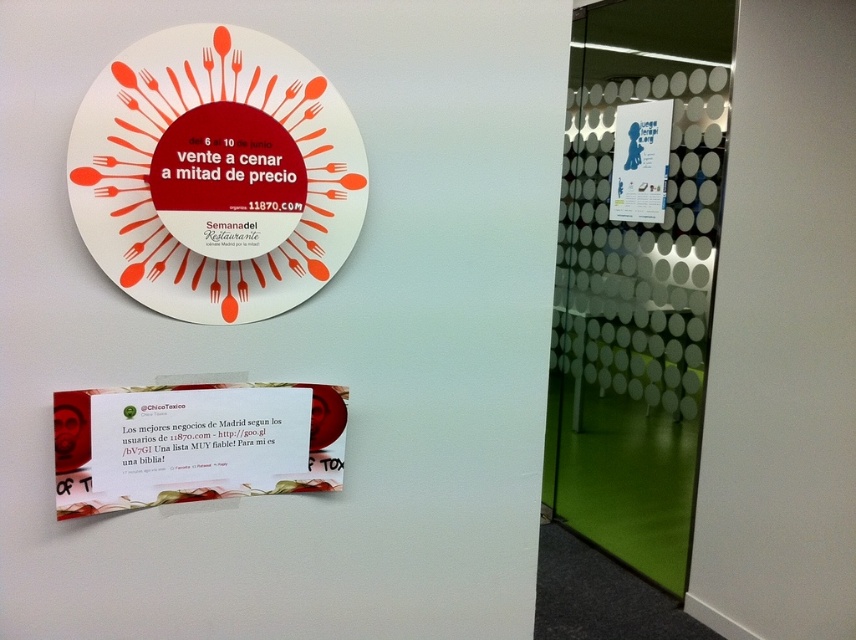
Between white paper plate at upper center and white paper poster at upper right, which one has less height?

white paper plate at upper center is shorter.

Where is `white paper plate at upper center`? white paper plate at upper center is located at coordinates (217, 173).

The height and width of the screenshot is (640, 856). I want to click on white paper plate at upper center, so click(x=217, y=173).

Can you confirm if white paper plate at upper center is positioned above white paper at center?

Indeed, white paper plate at upper center is positioned over white paper at center.

From the picture: Between white paper plate at upper center and white paper at center, which one has less height?

Standing shorter between the two is white paper at center.

Locate an element on the screen. This screenshot has height=640, width=856. white paper plate at upper center is located at coordinates (217, 173).

Describe the element at coordinates (194, 444) in the screenshot. I see `white paper at center` at that location.

Can you confirm if white paper at center is bigger than white paper poster at upper right?

Actually, white paper at center might be smaller than white paper poster at upper right.

Is point (104, 468) positioned before point (663, 141)?

Yes.

The width and height of the screenshot is (856, 640). I want to click on white paper at center, so click(x=194, y=444).